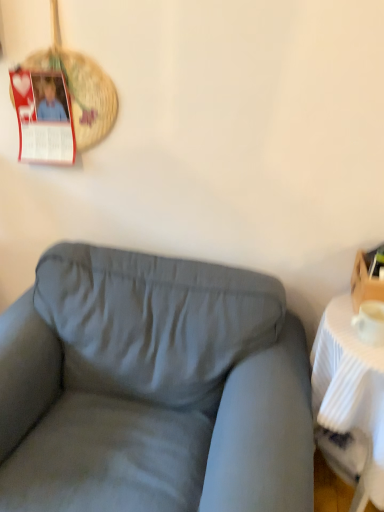
Question: Is white ribbed table at right at the right side of suede gray couch at center?

Choices:
 (A) no
 (B) yes

Answer: (B)

Question: Does white ribbed table at right have a lesser height compared to suede gray couch at center?

Choices:
 (A) yes
 (B) no

Answer: (A)

Question: Is white ribbed table at right closer to the viewer compared to suede gray couch at center?

Choices:
 (A) no
 (B) yes

Answer: (A)

Question: From the image's perspective, would you say white ribbed table at right is shown under suede gray couch at center?

Choices:
 (A) no
 (B) yes

Answer: (B)

Question: Is white ribbed table at right looking in the opposite direction of suede gray couch at center?

Choices:
 (A) no
 (B) yes

Answer: (A)

Question: Is point (377, 253) closer or farther from the camera than point (150, 380)?

Choices:
 (A) farther
 (B) closer

Answer: (B)

Question: Considering the relative positions of wooden box at right and suede gray couch at center in the image provided, is wooden box at right to the left or to the right of suede gray couch at center?

Choices:
 (A) right
 (B) left

Answer: (A)

Question: From their relative heights in the image, would you say wooden box at right is taller or shorter than suede gray couch at center?

Choices:
 (A) tall
 (B) short

Answer: (B)

Question: Considering their positions, is wooden box at right located in front of or behind suede gray couch at center?

Choices:
 (A) behind
 (B) front

Answer: (A)

Question: From the image's perspective, is suede gray couch at center located above or below white ribbed table at right?

Choices:
 (A) above
 (B) below

Answer: (A)

Question: Looking at the image, does suede gray couch at center seem bigger or smaller compared to white ribbed table at right?

Choices:
 (A) big
 (B) small

Answer: (A)

Question: Is suede gray couch at center in front of or behind white ribbed table at right in the image?

Choices:
 (A) behind
 (B) front

Answer: (B)

Question: Considering the positions of suede gray couch at center and white ribbed table at right in the image, is suede gray couch at center wider or thinner than white ribbed table at right?

Choices:
 (A) wide
 (B) thin

Answer: (A)

Question: Would you say suede gray couch at center is to the left or to the right of woven straw basket at upper left in the picture?

Choices:
 (A) right
 (B) left

Answer: (A)

Question: From the image's perspective, is suede gray couch at center positioned above or below woven straw basket at upper left?

Choices:
 (A) below
 (B) above

Answer: (A)